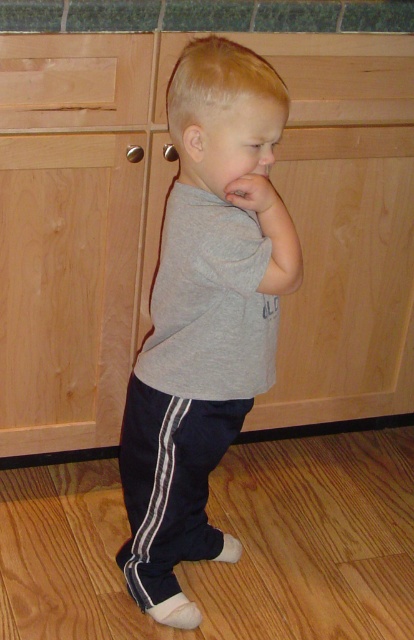
Is point (144, 380) farther from camera compared to point (226, 189)?

Yes, it is.

Is point (214, 364) positioned in front of point (247, 179)?

No, it is not.

Between point (221, 400) and point (262, 218), which one is positioned in front?

Point (262, 218)

Where is `gray matte shirt at center`? gray matte shirt at center is located at coordinates (202, 320).

Between wooden at upper center and beech wood drawer at upper left, which one appears on the right side from the viewer's perspective?

Positioned to the right is wooden at upper center.

Does wooden at upper center come in front of beech wood drawer at upper left?

No, it is behind beech wood drawer at upper left.

Is point (373, 96) in front of point (64, 125)?

No, (373, 96) is behind (64, 125).

You are a GUI agent. You are given a task and a screenshot of the screen. Output one action in this format:
    pyautogui.click(x=<x>, y=<y>)
    Task: Click on the wooden at upper center
    
    Given the screenshot: What is the action you would take?
    pyautogui.click(x=341, y=76)

Which is in front, point (146, 36) or point (235, 196)?

Point (235, 196) is in front.

Does beech wood drawer at upper left have a larger size compared to matte gray hand at center?

Yes.

Locate an element on the screen. beech wood drawer at upper left is located at coordinates click(74, 80).